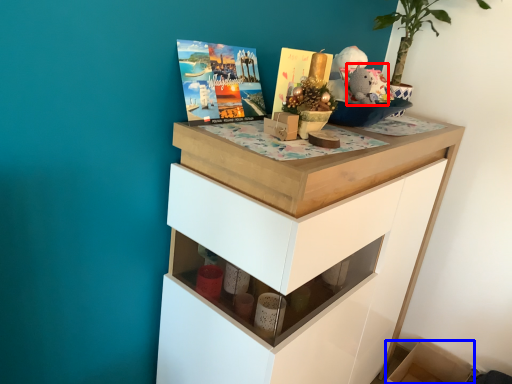
Question: Which object appears farthest to the camera in this image, animal (highlighted by a red box) or cabinetry (highlighted by a blue box)?

Choices:
 (A) animal
 (B) cabinetry

Answer: (B)